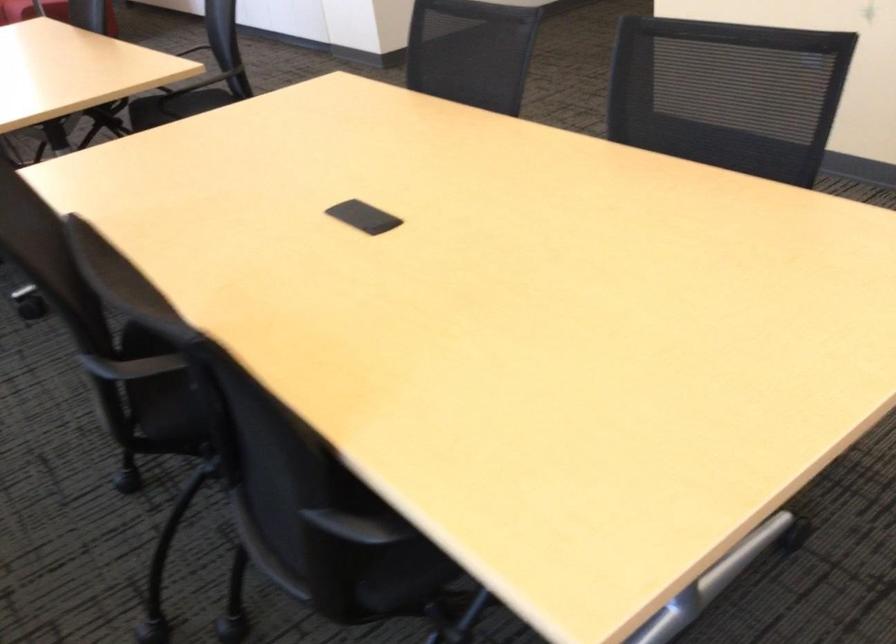
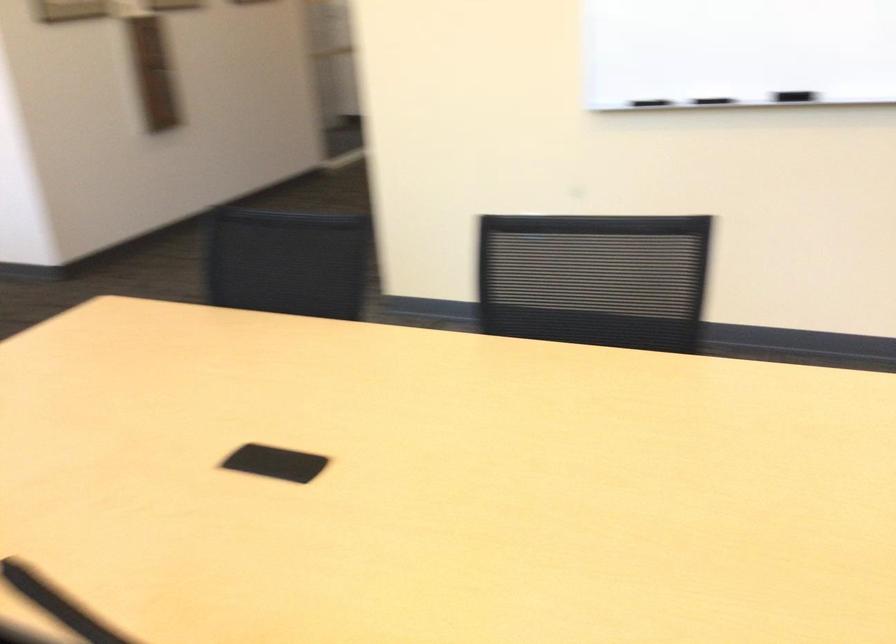
Which direction would the cameraman need to move to produce the second image?

The cameraman walked toward left, forward.